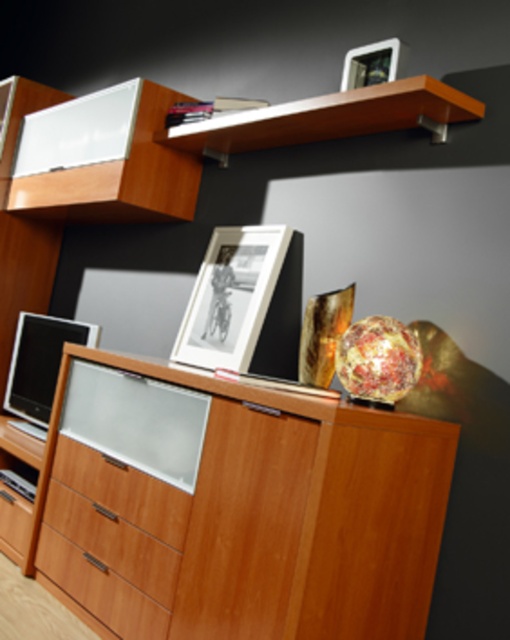
You are arranging a new plant pot in the living room and want to place it between the wooden shelf at upper center and the wooden drawer at lower left. Can you place the plant pot in the space between them?

The wooden shelf at upper center is in front of the wooden drawer at lower left, so there is no space between them for placing the plant pot.

Consider the image. You are standing in the living room and want to place a small plant on the light wood drawer at lower center. Based on its position, can you confirm if the drawer is within reach from the sofa placed directly in front of the entertainment unit?

The light wood drawer at lower center is located at point coordinates that suggest it is positioned lower and closer to the front of the entertainment unit. Since the sofa is directly in front, the drawer should be within easy reach for placing the plant.

You are an interior designer assessing the living room layout. You notice the matte black frame at upper center and the wooden drawer at lower left. Which object takes up more visual space in the room?

The matte black frame at upper center takes up more visual space in the room because it is bigger than the wooden drawer at lower left.